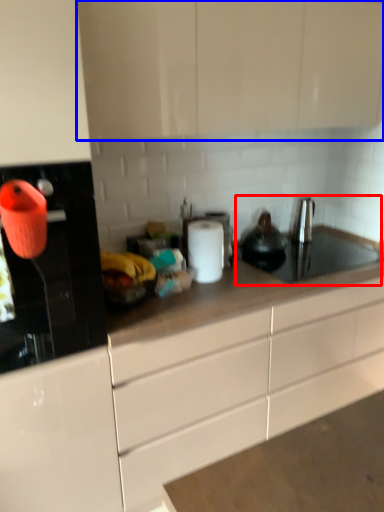
Question: Which object is further to the camera taking this photo, sink (highlighted by a red box) or cabinetry (highlighted by a blue box)?

Choices:
 (A) sink
 (B) cabinetry

Answer: (A)